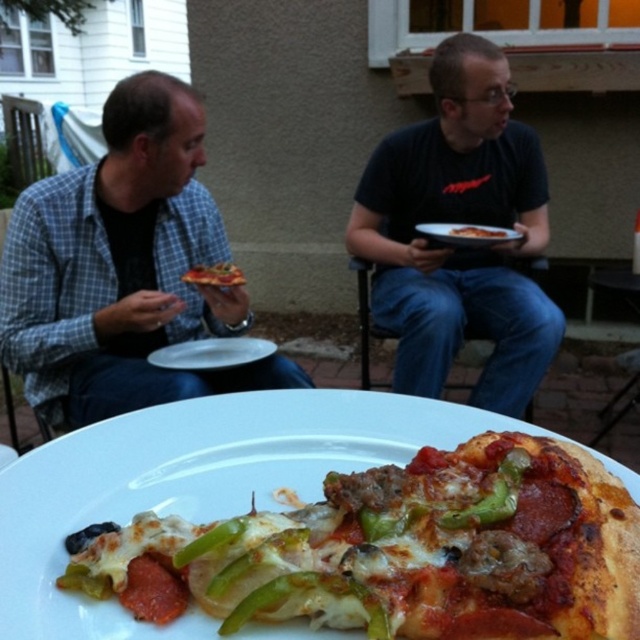
From the picture: Does white matte plate at center appear under cheesy pepperoni pizza at center?

No.

Is white matte plate at center behind cheesy pepperoni pizza at center?

Yes, it is.

Who is more forward, [481,228] or [216,262]?

Point [216,262] is in front.

Find the location of a particular element. Image resolution: width=640 pixels, height=640 pixels. white matte plate at center is located at coordinates (465, 234).

Who is positioned more to the right, white glossy plate at center or cheesy pepperoni pizza at center?

From the viewer's perspective, cheesy pepperoni pizza at center appears more on the right side.

In the scene shown: Which of these two, white glossy plate at center or cheesy pepperoni pizza at center, stands taller?

With more height is cheesy pepperoni pizza at center.

Who is more forward, (275, 349) or (195, 266)?

Point (275, 349) is in front.

You are a GUI agent. You are given a task and a screenshot of the screen. Output one action in this format:
    pyautogui.click(x=<x>, y=<y>)
    Task: Click on the white glossy plate at center
    The width and height of the screenshot is (640, 640).
    Given the screenshot: What is the action you would take?
    pyautogui.click(x=211, y=353)

Does matte black shirt at left appear under white glossy plate at center?

No.

Does matte black shirt at left lie in front of white glossy plate at center?

Yes, it is.

Who is more forward, (216, 307) or (180, 346)?

Point (216, 307) is more forward.

The width and height of the screenshot is (640, 640). Find the location of `matte black shirt at left`. matte black shirt at left is located at coordinates (122, 268).